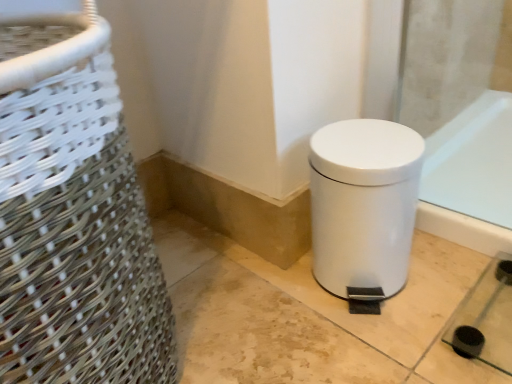
Identify the location of free space to the right of white matte waste container at lower right. (444, 273).